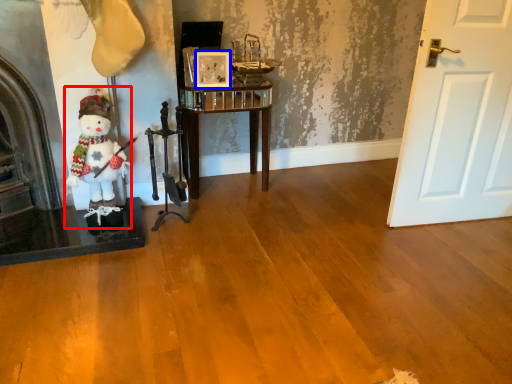
Question: Among these objects, which one is farthest to the camera, figurine (highlighted by a red box) or picture frame (highlighted by a blue box)?

Choices:
 (A) figurine
 (B) picture frame

Answer: (B)